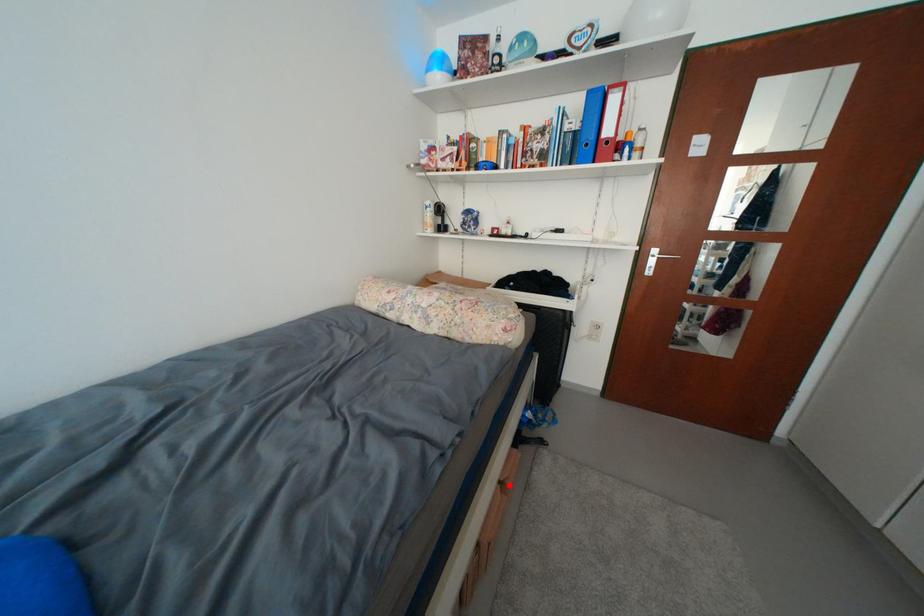
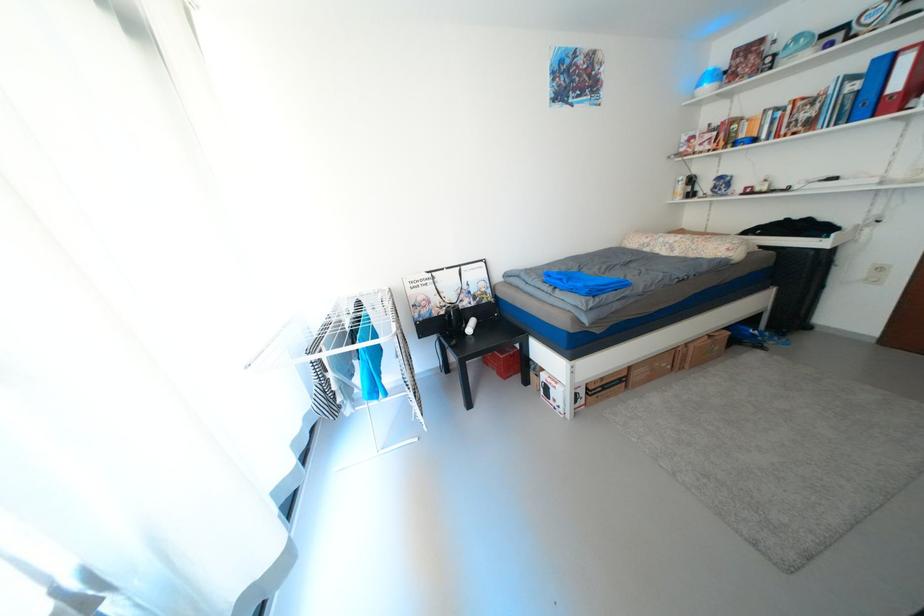
Locate, in the second image, the point that corresponds to the highlighted location in the first image.

(718, 338)